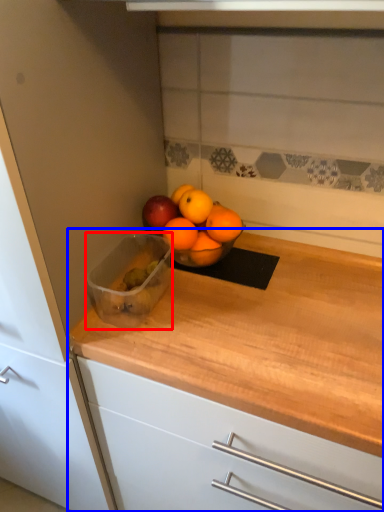
Question: Among these objects, which one is nearest to the camera, glass bowl (highlighted by a red box) or countertop (highlighted by a blue box)?

Choices:
 (A) glass bowl
 (B) countertop

Answer: (B)